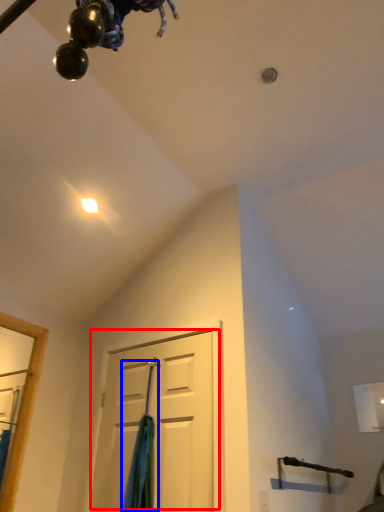
Question: Which point is closer to the camera, door (highlighted by a red box) or curtain (highlighted by a blue box)?

Choices:
 (A) door
 (B) curtain

Answer: (A)